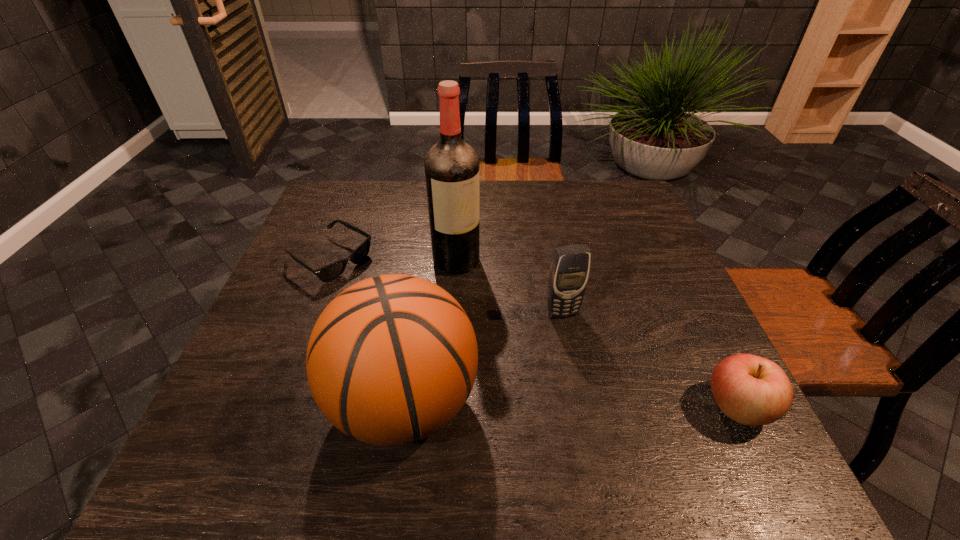
The width and height of the screenshot is (960, 540). What are the coordinates of `basketball` in the screenshot? It's located at (392, 359).

Image resolution: width=960 pixels, height=540 pixels. Identify the location of apple. (751, 390).

This screenshot has width=960, height=540. Identify the location of the rightmost object. (751, 390).

This screenshot has height=540, width=960. Identify the location of sunglasses. (327, 273).

This screenshot has width=960, height=540. I want to click on the second object from right to left, so pos(569,271).

Find the location of a particular element. This screenshot has width=960, height=540. the third tallest object is located at coordinates (569, 271).

Find the location of a particular element. The width and height of the screenshot is (960, 540). the tallest object is located at coordinates (451, 166).

Locate an element on the screen. The height and width of the screenshot is (540, 960). free spot located 0.120m on the left of the second tallest object is located at coordinates (268, 402).

I want to click on vacant space situated 0.340m on the left of the apple, so click(529, 407).

At what (x,y) coordinates should I click in order to perform the action: click on free space located on the front-facing side of the sunglasses. Please return your answer as a coordinate pair (x, y). The width and height of the screenshot is (960, 540). Looking at the image, I should click on (427, 319).